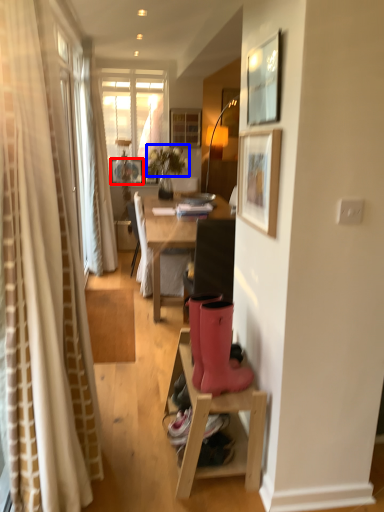
Question: Which object appears closest to the camera in this image, picture frame (highlighted by a red box) or flower (highlighted by a blue box)?

Choices:
 (A) picture frame
 (B) flower

Answer: (B)